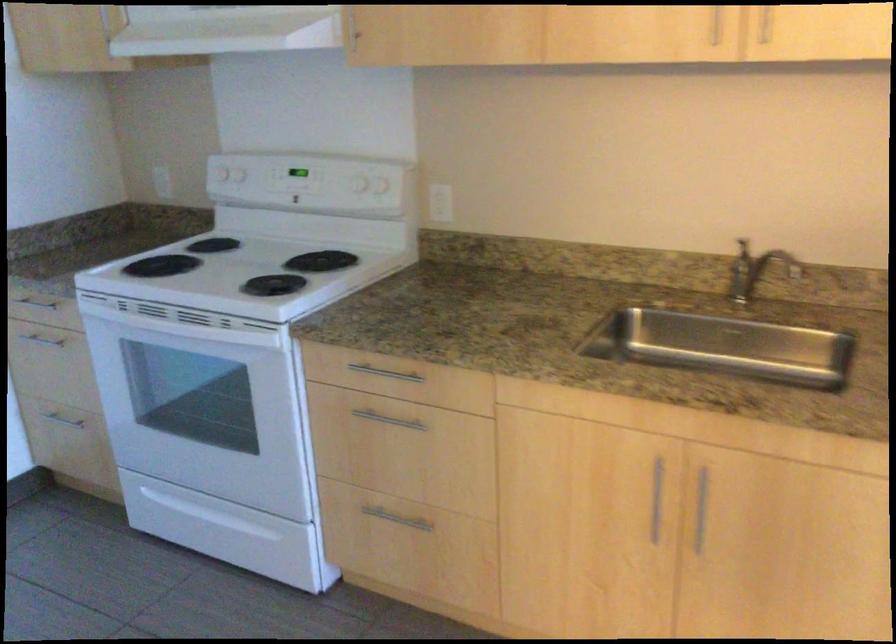
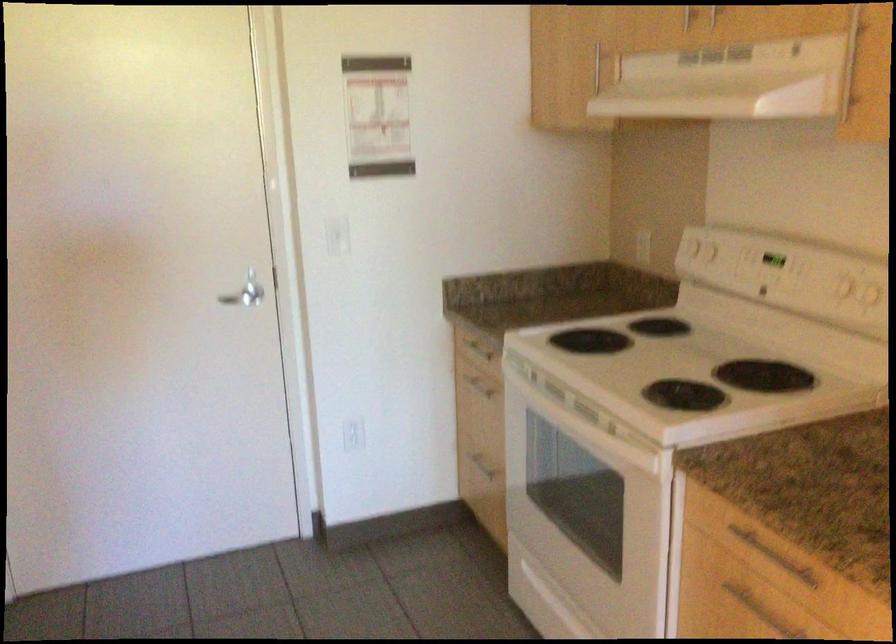
Locate, in the second image, the point that corresponds to point 259,267 in the first image.

(686, 365)